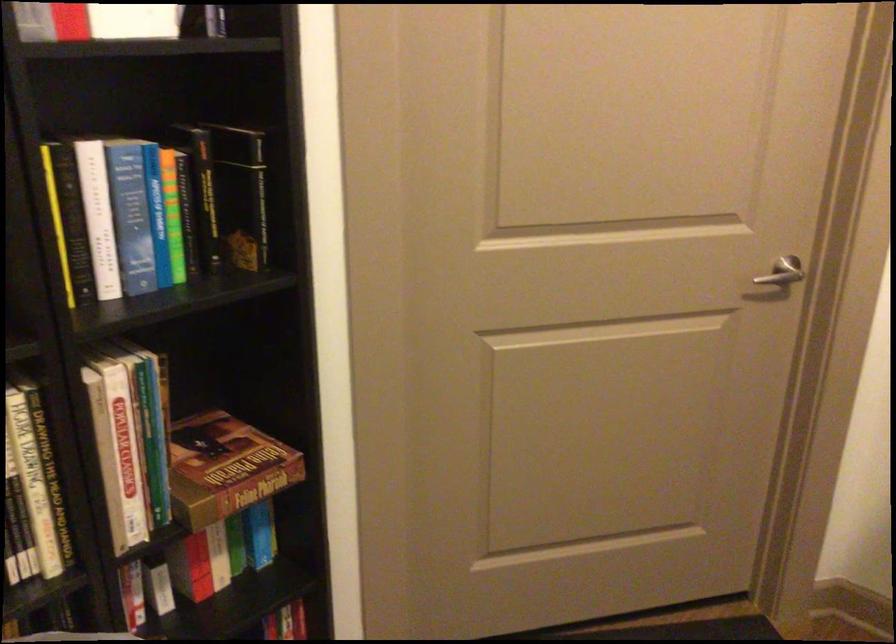
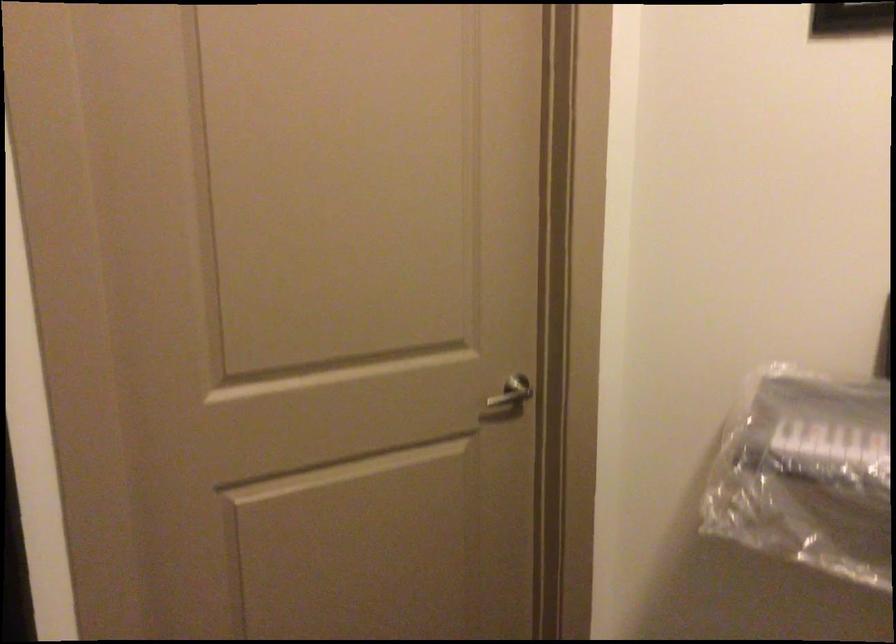
Question: What movement of the cameraman would produce the second image?

Choices:
 (A) Left
 (B) Right
 (C) Forward
 (D) Backward

Answer: (B)